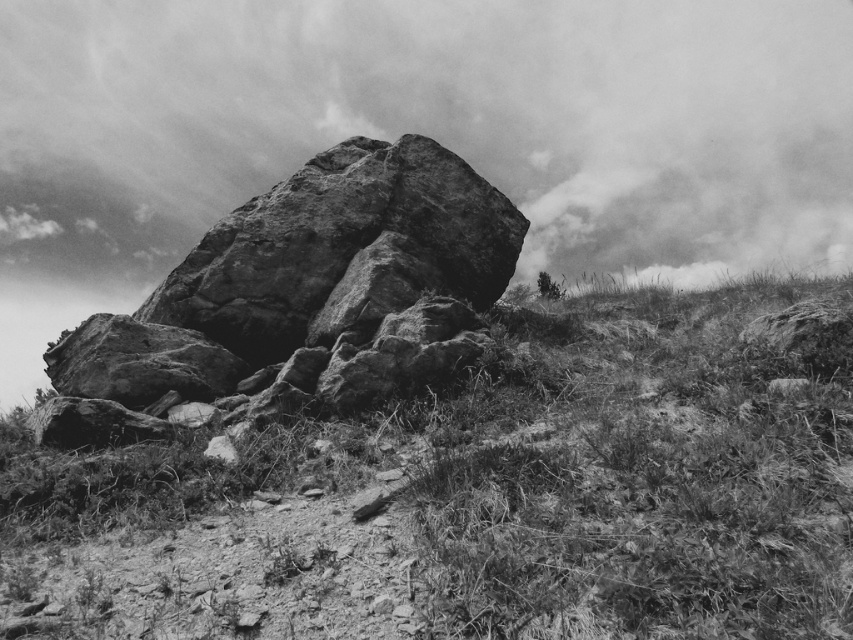
You are a hiker who has just arrived at this rugged outdoor scene. You notice a point marked at coordinates (480, 499). What is located at this point?

The point at coordinates (480, 499) indicates fuzzy green grass at center.

You are a photographer standing in the scene. You want to capture a photo that includes both the fuzzy green grass at center and the cloudy sky at upper center. Which object should appear closer to the camera in the final photo?

The fuzzy green grass at center should appear closer to the camera because it is in front of the cloudy sky at upper center.

You are standing at a point 17.76 feet away from the point marked at coordinates point (x=285, y=426). Given the rugged terrain described in the scene, do you think you can walk directly to that point without any obstacles?

The point marked at coordinates point (x=285, y=426) is 17.76 feet away from you. However, the rugged terrain with uneven ground, rocks, and debris around the large rock formation may obstruct your path, making it difficult to walk directly to that point without encountering obstacles.